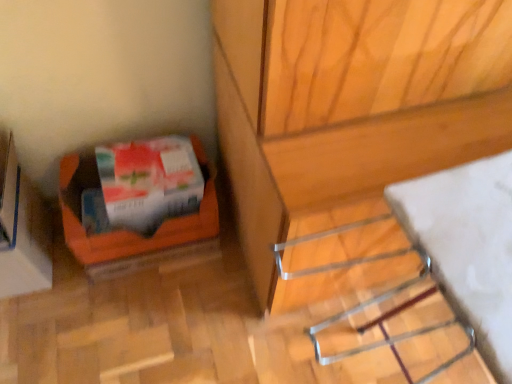
Question: From a real-world perspective, is orange cardboard box at lower left physically above white glossy wrapping paper at lower left?

Choices:
 (A) yes
 (B) no

Answer: (B)

Question: Can you confirm if orange cardboard box at lower left is positioned to the left of white glossy wrapping paper at lower left?

Choices:
 (A) no
 (B) yes

Answer: (B)

Question: Is orange cardboard box at lower left thinner than white glossy wrapping paper at lower left?

Choices:
 (A) yes
 (B) no

Answer: (B)

Question: Is orange cardboard box at lower left bigger than white glossy wrapping paper at lower left?

Choices:
 (A) yes
 (B) no

Answer: (A)

Question: Is orange cardboard box at lower left shorter than white glossy wrapping paper at lower left?

Choices:
 (A) yes
 (B) no

Answer: (B)

Question: Is orange cardboard box at lower left to the left or to the right of orange cardboard box at lower left in the image?

Choices:
 (A) right
 (B) left

Answer: (A)

Question: From a real-world perspective, is orange cardboard box at lower left physically located above or below orange cardboard box at lower left?

Choices:
 (A) below
 (B) above

Answer: (A)

Question: In terms of height, does orange cardboard box at lower left look taller or shorter compared to orange cardboard box at lower left?

Choices:
 (A) tall
 (B) short

Answer: (B)

Question: Based on their sizes in the image, would you say orange cardboard box at lower left is bigger or smaller than orange cardboard box at lower left?

Choices:
 (A) big
 (B) small

Answer: (A)

Question: In terms of height, does white glossy wrapping paper at lower left look taller or shorter compared to orange cardboard box at lower left?

Choices:
 (A) tall
 (B) short

Answer: (B)

Question: From the image's perspective, is white glossy wrapping paper at lower left above or below orange cardboard box at lower left?

Choices:
 (A) below
 (B) above

Answer: (B)

Question: Considering the relative positions of white glossy wrapping paper at lower left and orange cardboard box at lower left in the image provided, is white glossy wrapping paper at lower left to the left or to the right of orange cardboard box at lower left?

Choices:
 (A) left
 (B) right

Answer: (B)

Question: In terms of width, does white glossy wrapping paper at lower left look wider or thinner when compared to orange cardboard box at lower left?

Choices:
 (A) thin
 (B) wide

Answer: (A)

Question: Considering their positions, is orange cardboard box at lower left located in front of or behind white glossy wrapping paper at lower left?

Choices:
 (A) front
 (B) behind

Answer: (B)

Question: From a real-world perspective, is orange cardboard box at lower left above or below white glossy wrapping paper at lower left?

Choices:
 (A) below
 (B) above

Answer: (A)